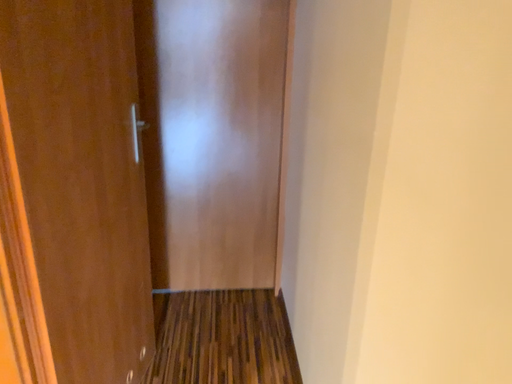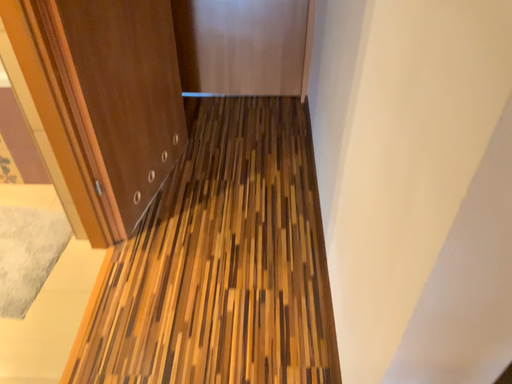
Question: How did the camera likely rotate when shooting the video?

Choices:
 (A) rotated downward
 (B) rotated upward

Answer: (A)